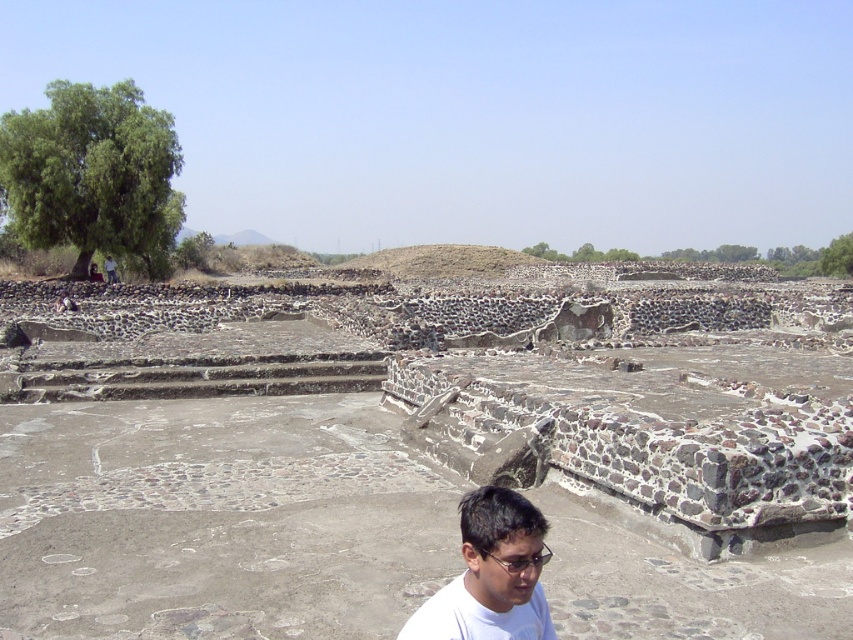
Does green leafy tree at upper right have a lesser width compared to transparent plastic glasses at lower center?

In fact, green leafy tree at upper right might be wider than transparent plastic glasses at lower center.

Who is higher up, green leafy tree at upper right or transparent plastic glasses at lower center?

green leafy tree at upper right is above.

Which is in front, point (851, 257) or point (508, 563)?

Point (508, 563) is in front.

This screenshot has width=853, height=640. In order to click on green leafy tree at upper right in this screenshot , I will do `click(837, 257)`.

Does point (509, 552) lie behind point (103, 264)?

No, (509, 552) is in front of (103, 264).

Can you confirm if white matte shirt at lower center is shorter than matte gray stone figure at upper left?

Incorrect, white matte shirt at lower center's height does not fall short of matte gray stone figure at upper left's.

Is point (534, 540) farther from camera compared to point (111, 268)?

No, (534, 540) is in front of (111, 268).

This screenshot has width=853, height=640. In order to click on white matte shirt at lower center in this screenshot , I will do `click(491, 573)`.

Is green leafy tree at upper left shorter than transparent plastic glasses at lower center?

Incorrect, green leafy tree at upper left's height does not fall short of transparent plastic glasses at lower center's.

Is green leafy tree at upper left wider than transparent plastic glasses at lower center?

Yes, green leafy tree at upper left is wider than transparent plastic glasses at lower center.

Describe the element at coordinates (91, 172) in the screenshot. Image resolution: width=853 pixels, height=640 pixels. I see `green leafy tree at upper left` at that location.

The width and height of the screenshot is (853, 640). In order to click on green leafy tree at upper left in this screenshot , I will do `click(91, 172)`.